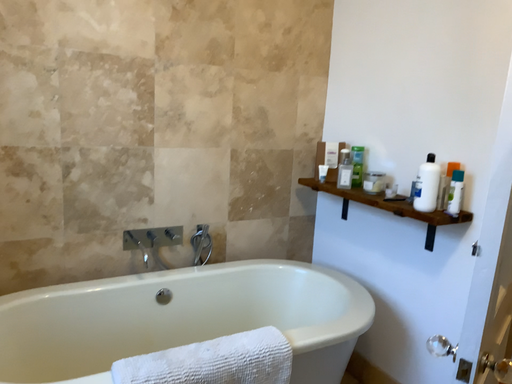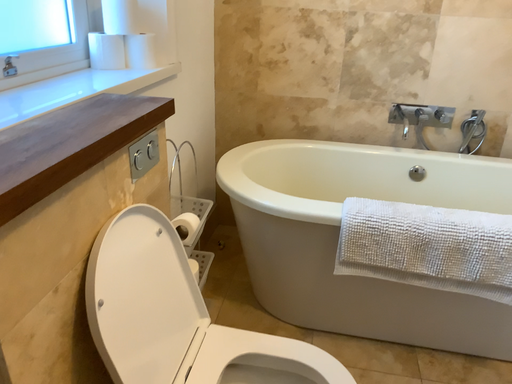
Question: How did the camera likely rotate when shooting the video?

Choices:
 (A) rotated left
 (B) rotated right

Answer: (A)